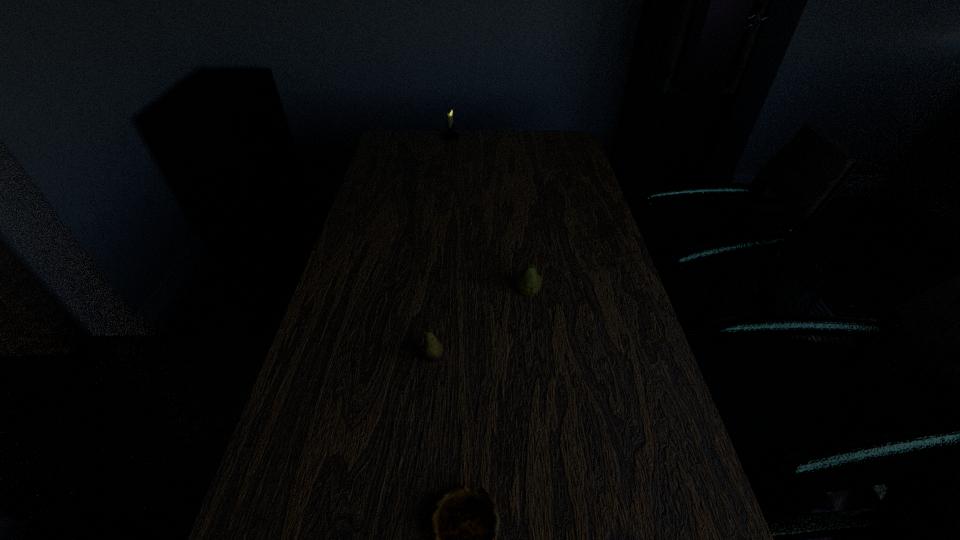
I want to click on free location at the left edge, so click(x=339, y=275).

You are a GUI agent. You are given a task and a screenshot of the screen. Output one action in this format:
    pyautogui.click(x=<x>, y=<y>)
    Task: Click on the vacant space at the right edge
    
    Given the screenshot: What is the action you would take?
    pyautogui.click(x=614, y=311)

The image size is (960, 540). I want to click on vacant space at the far left corner, so click(405, 140).

The height and width of the screenshot is (540, 960). In the image, there is a desktop. Find the location of `vacant space at the far right corner`. vacant space at the far right corner is located at coordinates (546, 138).

At what (x,y) coordinates should I click in order to perform the action: click on unoccupied area between the nearer pear and the rightmost object. Please return your answer as a coordinate pair (x, y). This screenshot has height=540, width=960. Looking at the image, I should click on (481, 325).

Where is `free point between the nearer pear and the farther pear`? Image resolution: width=960 pixels, height=540 pixels. free point between the nearer pear and the farther pear is located at coordinates [481, 325].

Find the location of `vacant area that lies between the farthest object and the left pear`. vacant area that lies between the farthest object and the left pear is located at coordinates (442, 248).

Where is `free space between the farther pear and the third farthest object`? free space between the farther pear and the third farthest object is located at coordinates click(x=481, y=325).

Locate an element on the screen. The width and height of the screenshot is (960, 540). free space between the farther pear and the third farthest object is located at coordinates (481, 325).

Identify which object is located as the nearest to the rightmost object. Please provide its 2D coordinates. Your answer should be formatted as a tuple, i.e. [(x, y)], where the tuple contains the x and y coordinates of a point satisfying the conditions above.

[(431, 351)]